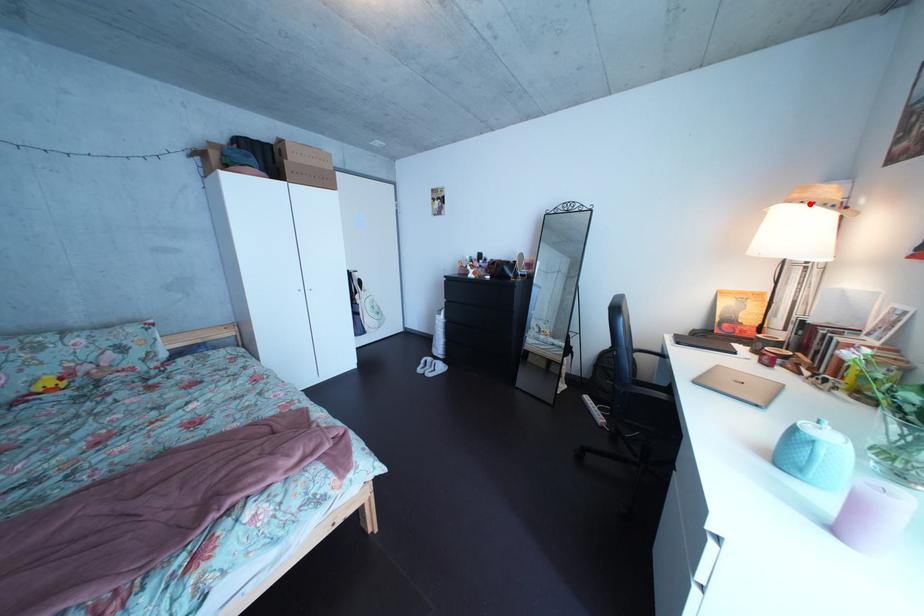
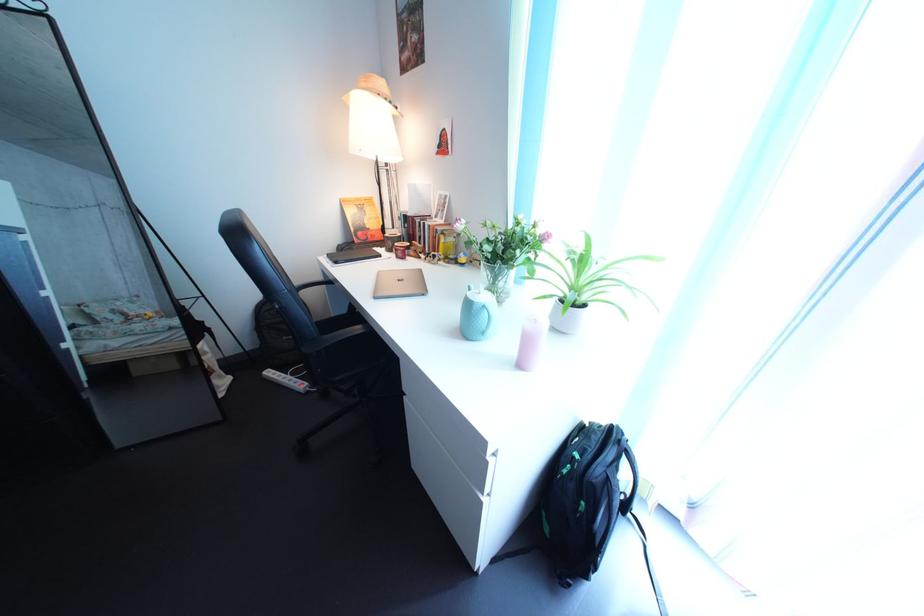
Find the pixel in the second image that matches the highlighted location in the first image.

(378, 92)